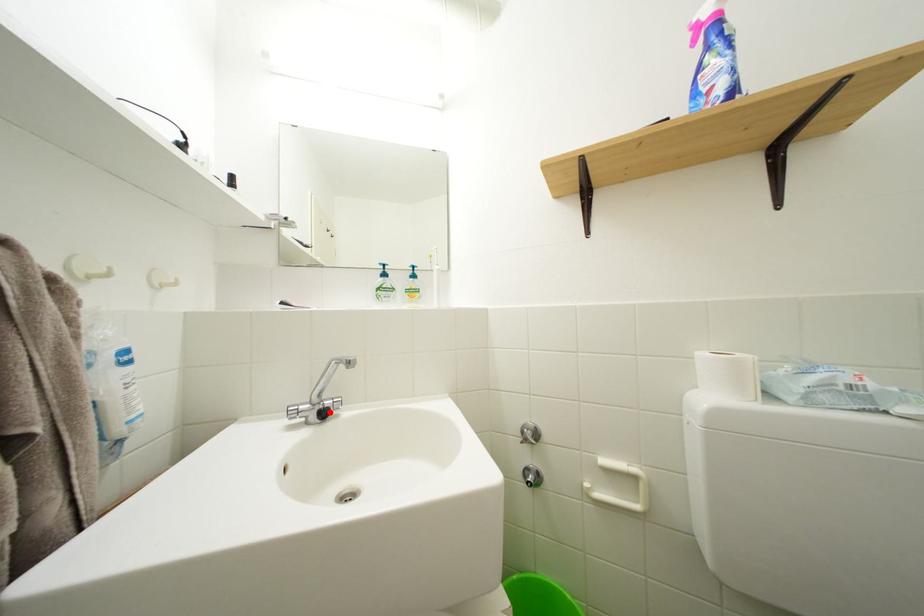
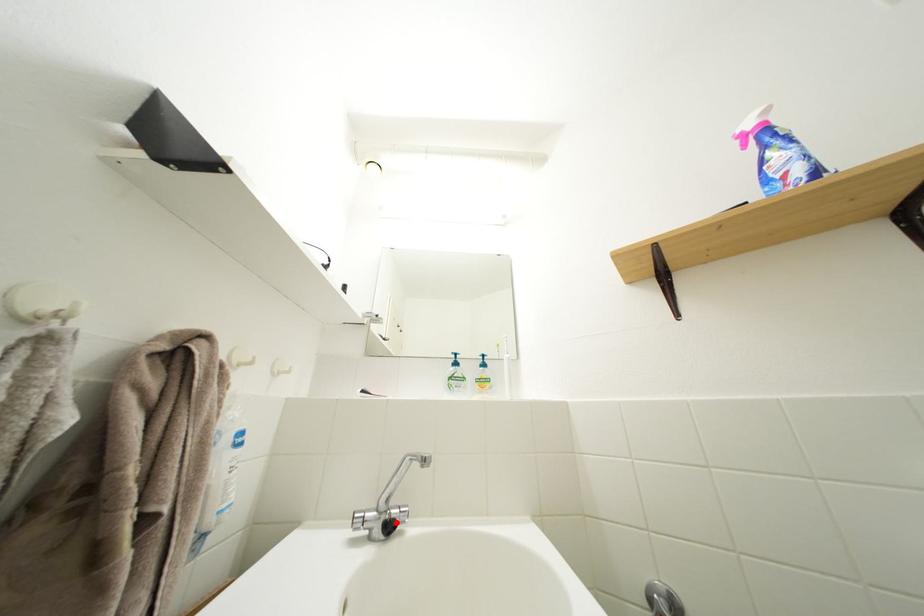
I am providing you with two images of the same scene from different viewpoints. A red point is marked on the first image and another point is marked on the second image. Does the point marked in image1 correspond to the same location as the one in image2?

Yes